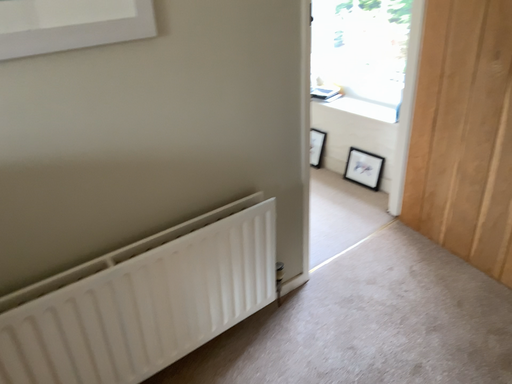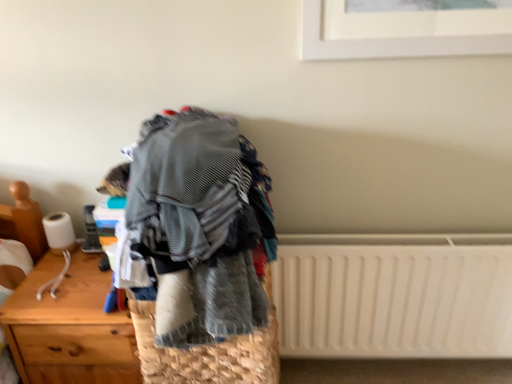
Question: How did the camera likely rotate when shooting the video?

Choices:
 (A) rotated upward
 (B) rotated downward

Answer: (A)